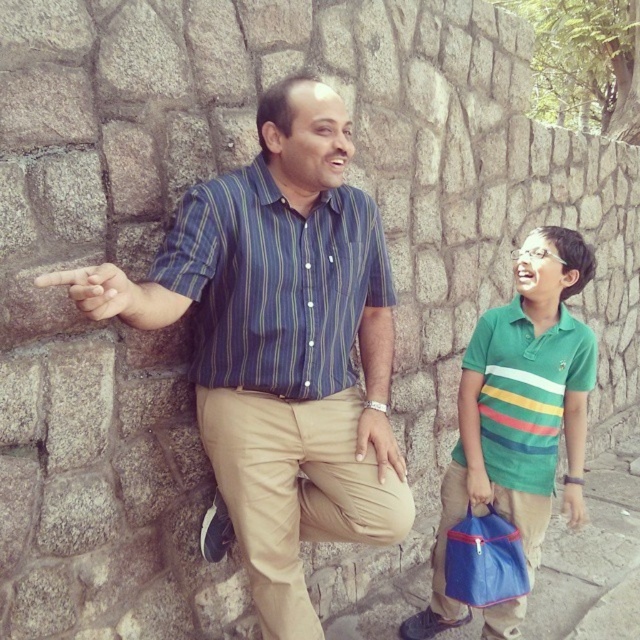
Between blue striped shirt at center and blue fabric bag at lower right, which one appears on the right side from the viewer's perspective?

blue fabric bag at lower right is more to the right.

The width and height of the screenshot is (640, 640). Find the location of `blue striped shirt at center`. blue striped shirt at center is located at coordinates (289, 348).

Who is positioned more to the left, khaki cotton pants at center or green fabric handbag at lower right?

From the viewer's perspective, khaki cotton pants at center appears more on the left side.

Which is in front, point (282, 605) or point (477, 476)?

Point (282, 605)

Who is more distant from viewer, (300, 572) or (480, 497)?

The point (480, 497) is more distant.

This screenshot has height=640, width=640. What are the coordinates of `khaki cotton pants at center` in the screenshot? It's located at (296, 492).

In the scene shown: Is blue fabric bag at lower right thinner than matte skin hand at left?

Incorrect, blue fabric bag at lower right's width is not less than matte skin hand at left's.

Who is shorter, blue fabric bag at lower right or matte skin hand at left?

matte skin hand at left

What are the coordinates of `blue fabric bag at lower right` in the screenshot? It's located at (484, 561).